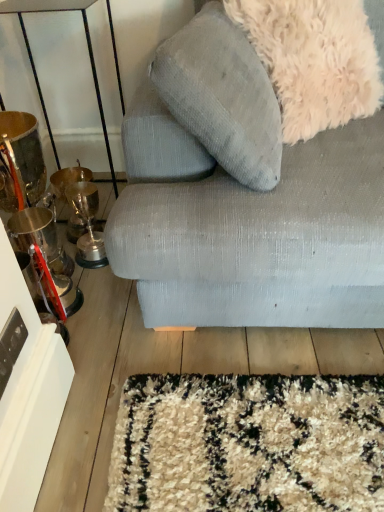
The image size is (384, 512). Describe the element at coordinates (262, 241) in the screenshot. I see `textured gray couch at upper right` at that location.

Locate an element on the screen. textured gray couch at upper right is located at coordinates (262, 241).

Where is `textured gray couch at upper right`? textured gray couch at upper right is located at coordinates (262, 241).